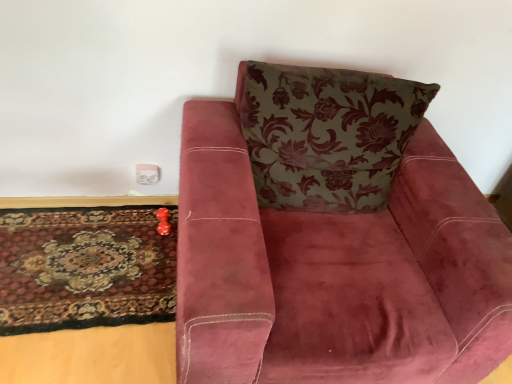
Question: Visually, is white plastic electric outlet at lower left positioned to the left or to the right of floral-patterned fabric pillow at upper center?

Choices:
 (A) left
 (B) right

Answer: (A)

Question: Considering the positions of white plastic electric outlet at lower left and floral-patterned fabric pillow at upper center in the image, is white plastic electric outlet at lower left wider or thinner than floral-patterned fabric pillow at upper center?

Choices:
 (A) wide
 (B) thin

Answer: (B)

Question: Considering the real-world distances, which object is farthest from the velvet maroon armchair at center?

Choices:
 (A) carpeted rug at lower left
 (B) floral-patterned fabric pillow at upper center
 (C) white plastic electric outlet at lower left

Answer: (C)

Question: Which is farther from the velvet maroon armchair at center?

Choices:
 (A) floral-patterned fabric pillow at upper center
 (B) carpeted rug at lower left
 (C) white plastic electric outlet at lower left

Answer: (C)